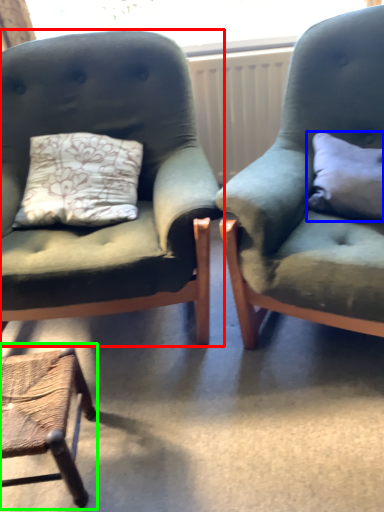
Question: Estimate the real-world distances between objects in this image. Which object is closer to chair (highlighted by a red box), pillow (highlighted by a blue box) or chair (highlighted by a green box)?

Choices:
 (A) pillow
 (B) chair

Answer: (B)